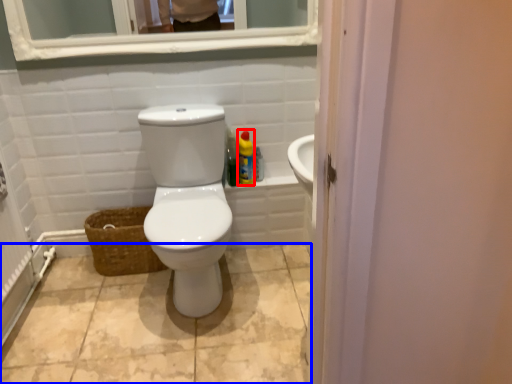
Question: Which object is further to the camera taking this photo, cleaning product (highlighted by a red box) or ceramic tile (highlighted by a blue box)?

Choices:
 (A) cleaning product
 (B) ceramic tile

Answer: (A)